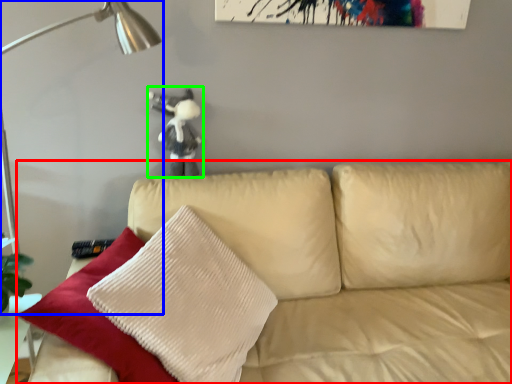
Question: Which is nearer to the studio couch (highlighted by a red box)? table lamp (highlighted by a blue box) or figurine (highlighted by a green box).

Choices:
 (A) table lamp
 (B) figurine

Answer: (B)